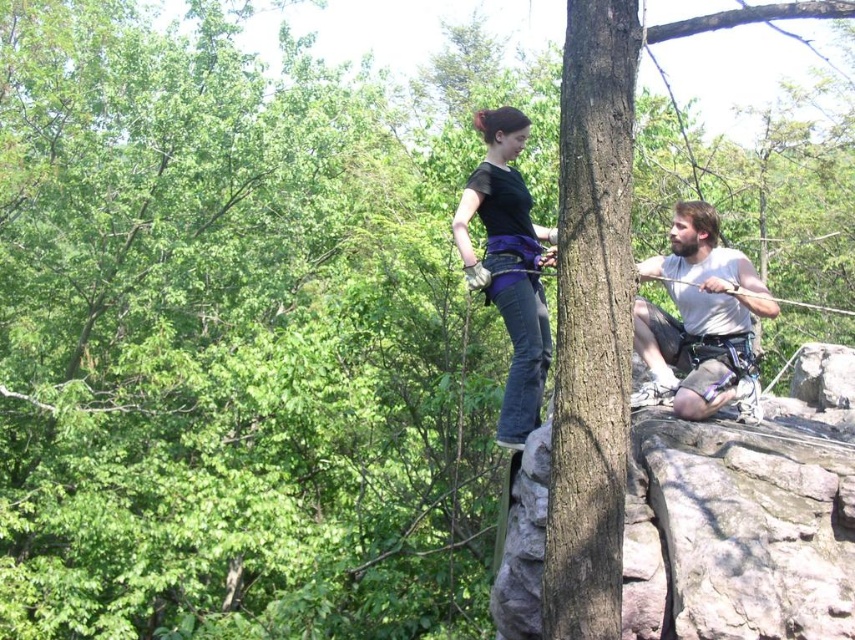
Question: Does light gray fabric shorts at right have a smaller size compared to black matte pants at center?

Choices:
 (A) yes
 (B) no

Answer: (A)

Question: Which object is closer to the camera taking this photo?

Choices:
 (A) light gray fabric shorts at right
 (B) black matte pants at center

Answer: (A)

Question: Is light gray fabric shorts at right wider than black matte pants at center?

Choices:
 (A) no
 (B) yes

Answer: (B)

Question: Among these points, which one is nearest to the camera?

Choices:
 (A) (503, 220)
 (B) (674, 227)

Answer: (B)

Question: Considering the relative positions of light gray fabric shorts at right and black matte pants at center in the image provided, where is light gray fabric shorts at right located with respect to black matte pants at center?

Choices:
 (A) right
 (B) left

Answer: (A)